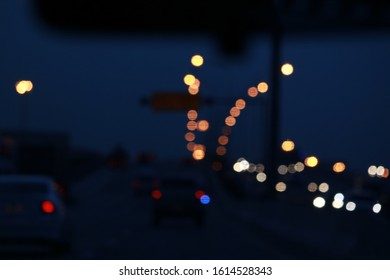
The height and width of the screenshot is (280, 390). Find the location of `light`. light is located at coordinates point(287,71).